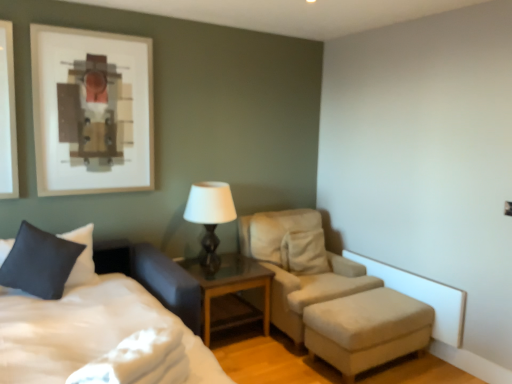
Question: Is white soft bed at lower left taller than glass wood nightstand at center?

Choices:
 (A) no
 (B) yes

Answer: (B)

Question: Considering the relative sizes of white soft bed at lower left and glass wood nightstand at center in the image provided, is white soft bed at lower left wider than glass wood nightstand at center?

Choices:
 (A) no
 (B) yes

Answer: (B)

Question: From the image's perspective, does white soft bed at lower left appear higher than glass wood nightstand at center?

Choices:
 (A) yes
 (B) no

Answer: (B)

Question: Is white soft bed at lower left outside of glass wood nightstand at center?

Choices:
 (A) no
 (B) yes

Answer: (B)

Question: From the image's perspective, would you say white soft bed at lower left is shown under glass wood nightstand at center?

Choices:
 (A) yes
 (B) no

Answer: (A)

Question: From a real-world perspective, is white soft bed at lower left on top of glass wood nightstand at center?

Choices:
 (A) no
 (B) yes

Answer: (B)

Question: Considering the relative sizes of beige fabric ottoman at lower right and matte black table lamp at center in the image provided, is beige fabric ottoman at lower right thinner than matte black table lamp at center?

Choices:
 (A) no
 (B) yes

Answer: (A)

Question: Can you confirm if beige fabric ottoman at lower right is taller than matte black table lamp at center?

Choices:
 (A) yes
 (B) no

Answer: (B)

Question: Would you say beige fabric ottoman at lower right contains matte black table lamp at center?

Choices:
 (A) yes
 (B) no

Answer: (B)

Question: From the image's perspective, is beige fabric ottoman at lower right located above matte black table lamp at center?

Choices:
 (A) yes
 (B) no

Answer: (B)

Question: From a real-world perspective, is beige fabric ottoman at lower right over matte black table lamp at center?

Choices:
 (A) no
 (B) yes

Answer: (A)

Question: From a real-world perspective, is beige fabric ottoman at lower right positioned under matte black table lamp at center based on gravity?

Choices:
 (A) no
 (B) yes

Answer: (B)

Question: Considering the relative positions of beige fabric ottoman at lower right and glass wood nightstand at center in the image provided, is beige fabric ottoman at lower right in front of glass wood nightstand at center?

Choices:
 (A) yes
 (B) no

Answer: (A)